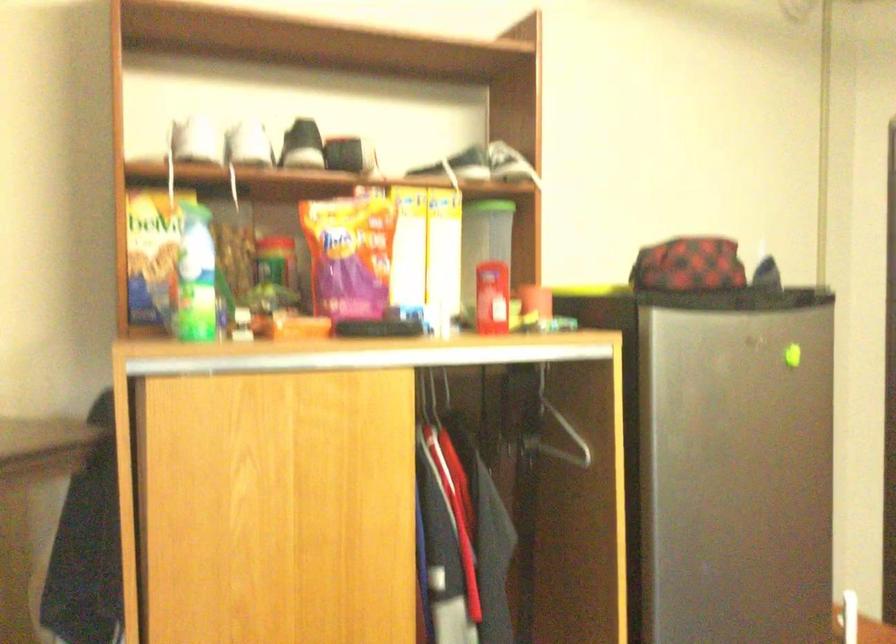
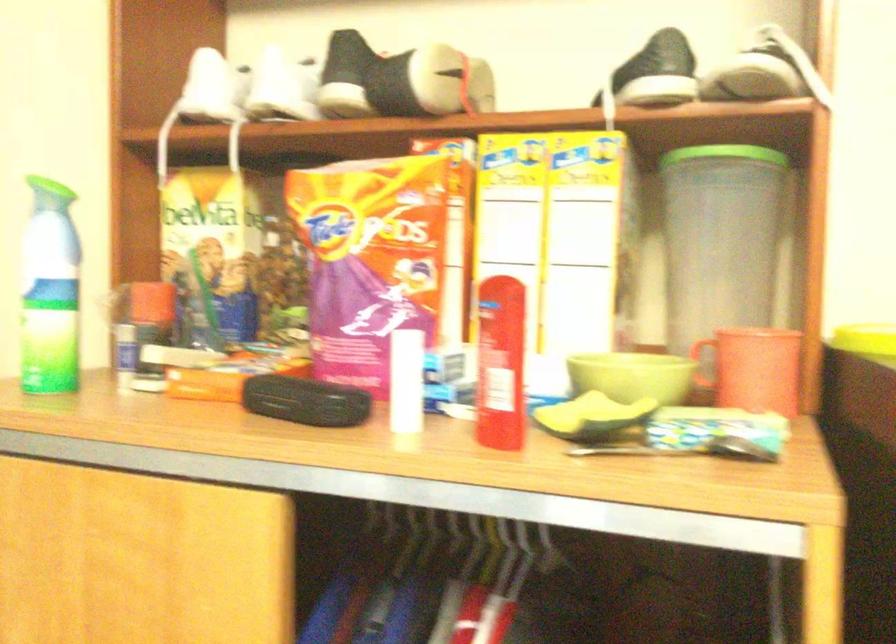
The point at (257, 147) is marked in the first image. Where is the corresponding point in the second image?

(280, 88)